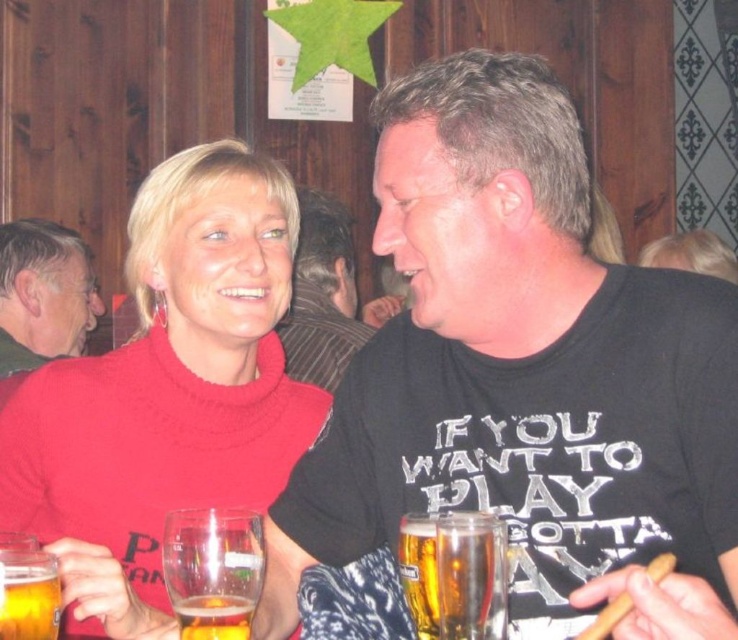
Question: Is matte black t-shirt at center positioned at the back of clear glass beer at lower left?

Choices:
 (A) yes
 (B) no

Answer: (A)

Question: Is knitted red sweater at center further to camera compared to translucent glass beer at center?

Choices:
 (A) yes
 (B) no

Answer: (A)

Question: Which object is farther from the camera taking this photo?

Choices:
 (A) translucent glass beer at lower center
 (B) translucent glass mug at lower center
 (C) translucent glass beer at center

Answer: (A)

Question: Which object is the farthest from the clear glass beer at lower left?

Choices:
 (A) translucent glass beer at center
 (B) translucent glass beer at lower center
 (C) translucent glass mug at lower center

Answer: (A)

Question: Can you confirm if clear glass beer at lower left is bigger than translucent glass beer at lower center?

Choices:
 (A) no
 (B) yes

Answer: (B)

Question: Which point is farther to the camera?

Choices:
 (A) translucent glass mug at lower center
 (B) matte black shirt at left

Answer: (B)